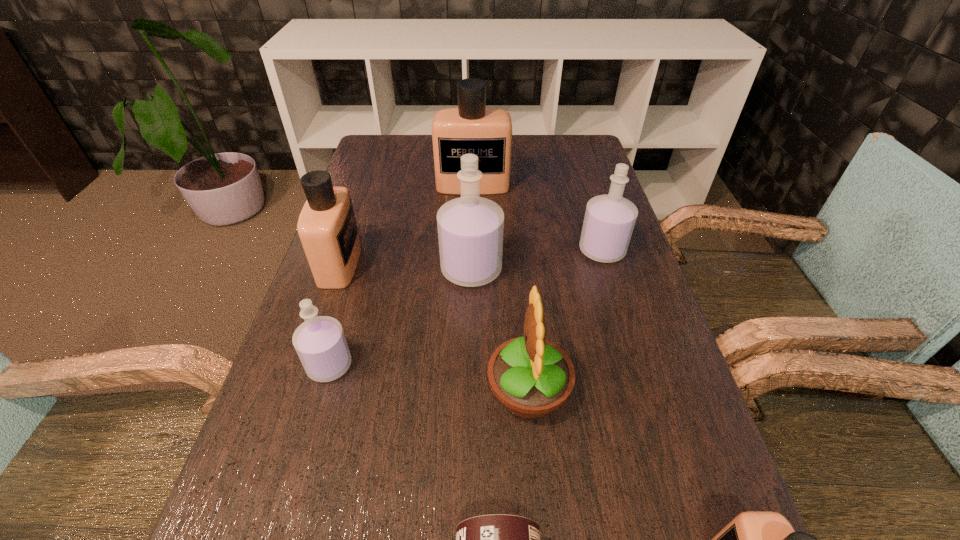
This screenshot has height=540, width=960. I want to click on free space that satisfies the following two spatial constraints: 1. on the front label of the biggest beige perfume; 2. on the front label of the leftmost beige perfume, so click(471, 264).